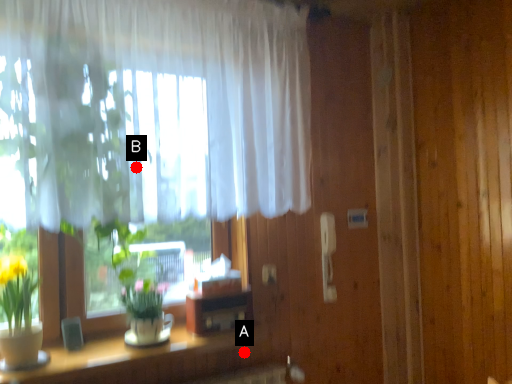
Question: Two points are circled on the image, labeled by A and B beside each circle. Which point is further to the camera?

Choices:
 (A) A is further
 (B) B is further

Answer: (A)